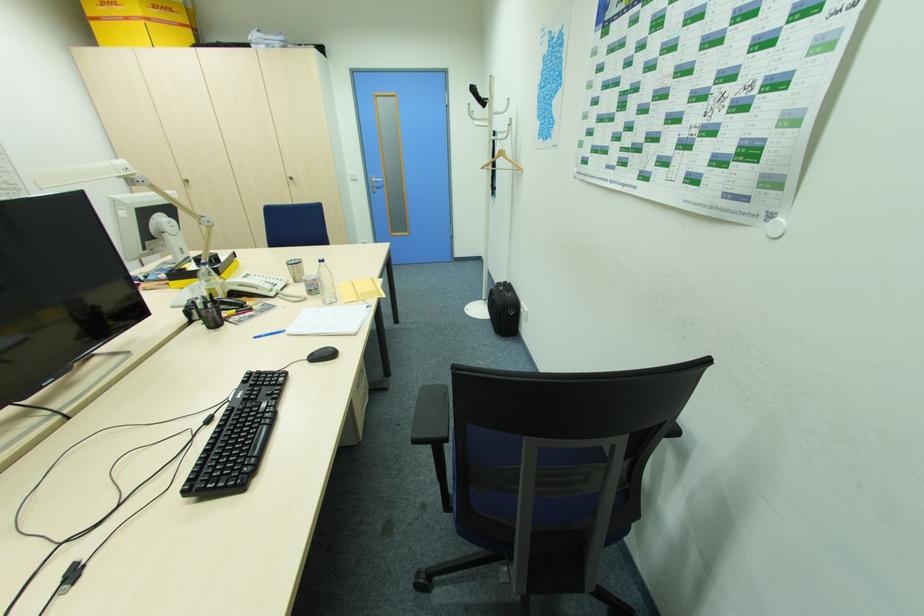
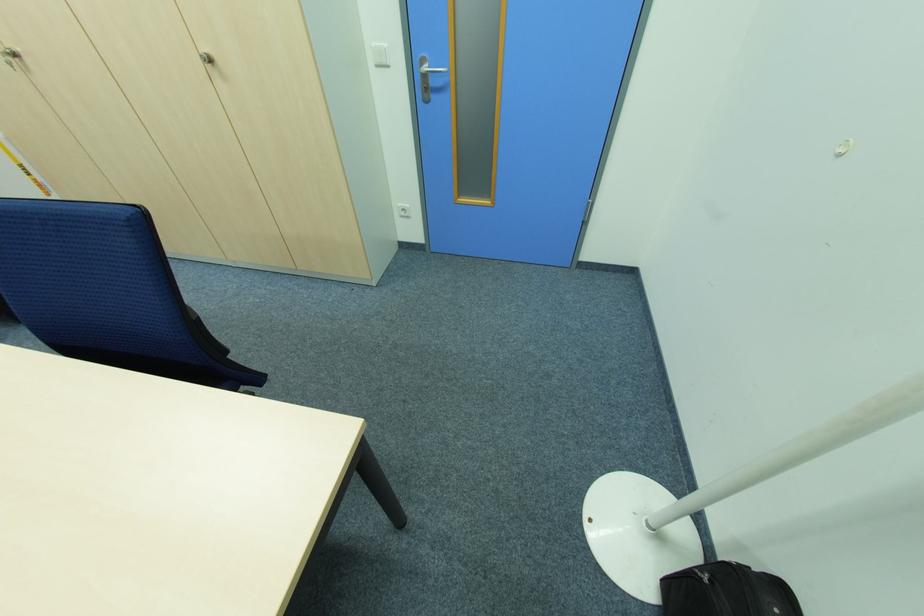
Find the pixel in the second image that matches point (189, 180) in the first image.

(18, 55)